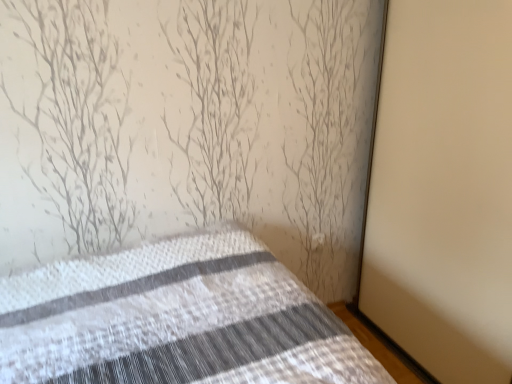
What do you see at coordinates (176, 319) in the screenshot? This screenshot has height=384, width=512. I see `white textured bedspread at lower left` at bounding box center [176, 319].

Measure the distance between point (9, 340) and camera.

Point (9, 340) and camera are 1.20 meters apart.

You are a GUI agent. You are given a task and a screenshot of the screen. Output one action in this format:
    pyautogui.click(x=<x>, y=<y>)
    Task: Click on the white textured bedspread at lower left
    This screenshot has width=512, height=384.
    Given the screenshot: What is the action you would take?
    pyautogui.click(x=176, y=319)

Measure the distance between white textured bedspread at lower left and camera.

1.01 meters.

This screenshot has width=512, height=384. Find the location of `white textured bedspread at lower left`. white textured bedspread at lower left is located at coordinates (176, 319).